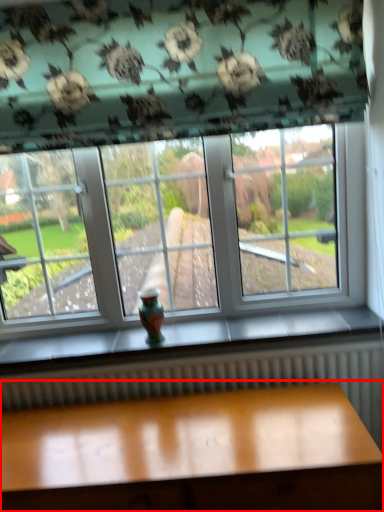
Question: From the image's perspective, what is the correct spatial relationship of table (annotated by the red box) in relation to glass vase?

Choices:
 (A) above
 (B) below

Answer: (B)